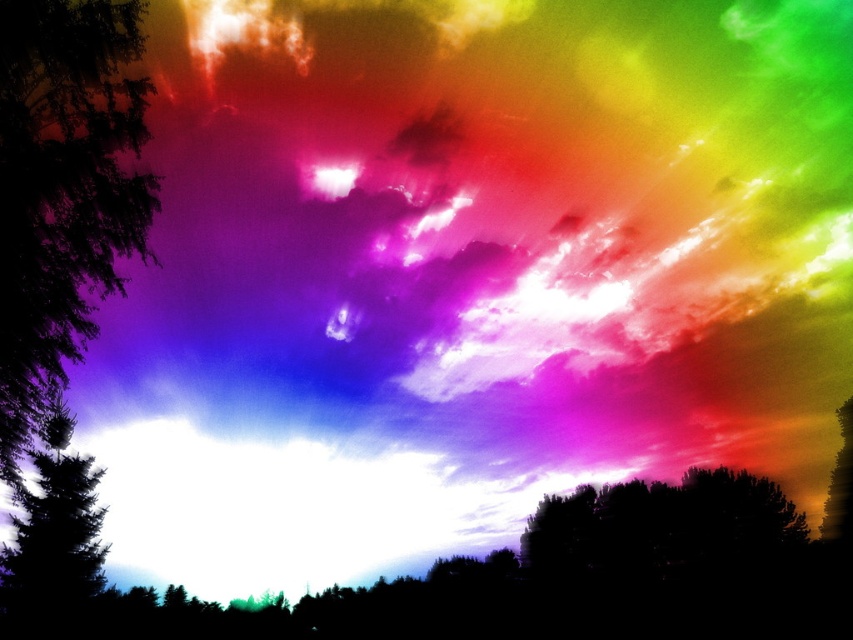
You are an artist trying to paint the scene. You notice two trees on the left side of the image. Which tree is positioned higher up in the sky, the silhouette leafy tree at left or the dark green textured tree at left?

The silhouette leafy tree at left is located above the dark green textured tree at left, so it is positioned higher up in the sky.

You are standing in a field and see two trees on your left side. The first is a silhouette leafy tree at left and the second is a dark green textured tree at left. If you want to walk between them, can you fit through the space between them?

The silhouette leafy tree at left and dark green textured tree at left are 31.22 feet apart from each other, so yes, you can easily walk between them as the distance is more than enough for a person to pass through comfortably.

Consider the image. You are an artist analyzing the composition of the scene. Which tree at the left side of the image is taller between the silhouette leafy tree at left and the dark green textured tree at left?

The silhouette leafy tree at left is taller than the dark green textured tree at left according to the description provided.